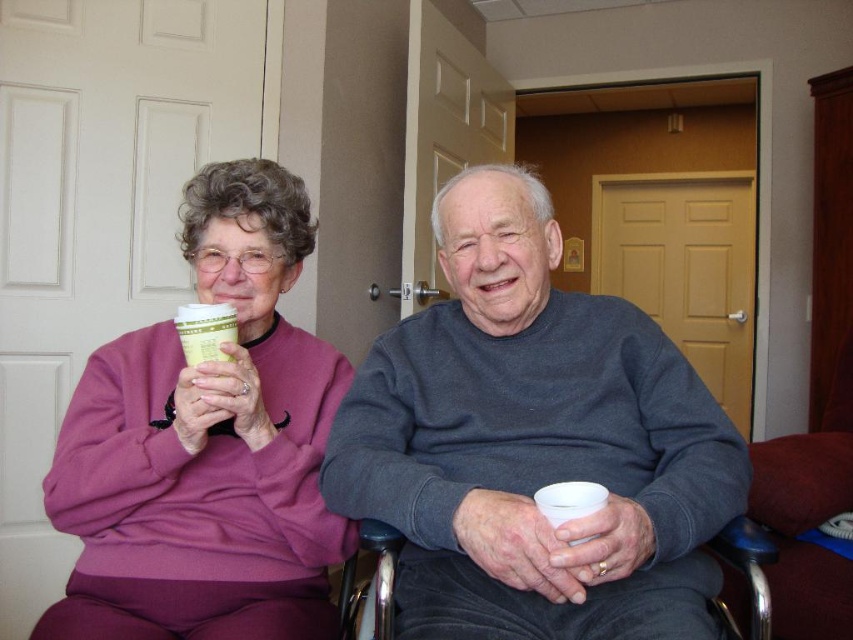
Between point (665, 336) and point (233, 308), which one is positioned behind?

Point (665, 336)

Looking at this image, is gray sweater at center positioned at the back of green paper cup at upper left?

No, gray sweater at center is in front of green paper cup at upper left.

The image size is (853, 640). What do you see at coordinates (534, 444) in the screenshot?
I see `gray sweater at center` at bounding box center [534, 444].

Locate an element on the screen. gray sweater at center is located at coordinates (534, 444).

Is gray sweater at center shorter than matte purple sweater at upper left?

Yes.

Is gray sweater at center closer to camera compared to matte purple sweater at upper left?

Yes, it is in front of matte purple sweater at upper left.

Does point (532, 513) lie in front of point (195, 417)?

That is True.

Locate an element on the screen. This screenshot has width=853, height=640. gray sweater at center is located at coordinates (534, 444).

Can you confirm if matte purple sweater at upper left is positioned to the right of green paper cup at upper left?

Yes, matte purple sweater at upper left is to the right of green paper cup at upper left.

The width and height of the screenshot is (853, 640). Identify the location of matte purple sweater at upper left. (206, 445).

The width and height of the screenshot is (853, 640). I want to click on matte purple sweater at upper left, so (x=206, y=445).